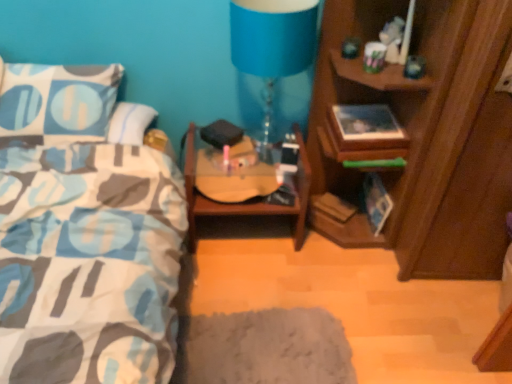
Identify the location of free point below wooden guitar case at center (from a real-world perspective). (245, 231).